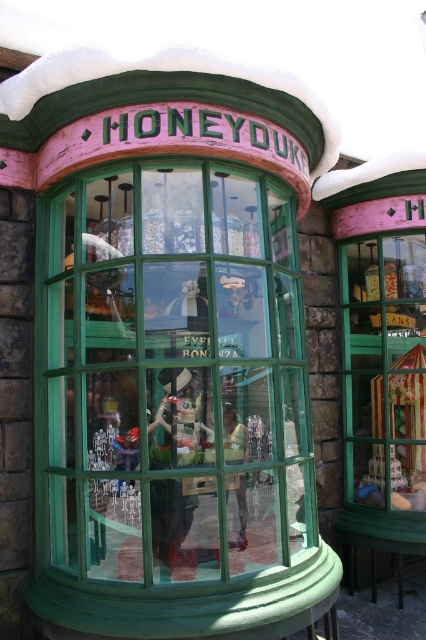
Is point (140, 292) farther from camera compared to point (391, 456)?

No, it is not.

Looking at this image, does green glass window at center appear on the left side of striped fabric tent at right?

Yes, green glass window at center is to the left of striped fabric tent at right.

Between point (279, 355) and point (416, 488), which one is positioned in front?

Point (279, 355) is in front.

The height and width of the screenshot is (640, 426). I want to click on green glass window at center, so click(x=175, y=374).